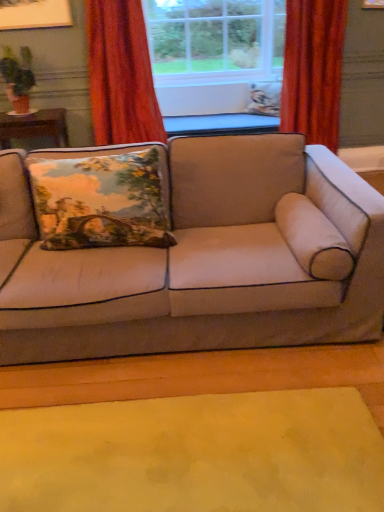
Question: Is velvet-like red curtain at right, positioned as the second curtain in left-to-right order, shorter than floral fabric pillow at center, placed as the 2th pillow when sorted from bottom to top?

Choices:
 (A) no
 (B) yes

Answer: (A)

Question: Is velvet-like red curtain at right, acting as the first curtain starting from the right, to the right of floral fabric pillow at center, which appears as the 2th pillow when viewed from the left, from the viewer's perspective?

Choices:
 (A) yes
 (B) no

Answer: (A)

Question: Can you confirm if velvet-like red curtain at right, acting as the first curtain starting from the right, is wider than floral fabric pillow at center, which is counted as the second pillow, starting from the front?

Choices:
 (A) yes
 (B) no

Answer: (A)

Question: Is velvet-like red curtain at right, acting as the first curtain starting from the right, turned away from floral fabric pillow at center, placed as the 2th pillow when sorted from bottom to top?

Choices:
 (A) no
 (B) yes

Answer: (B)

Question: Is the position of velvet-like red curtain at right, acting as the first curtain starting from the right, more distant than that of floral fabric pillow at center, which appears as the 1th pillow when viewed from the top?

Choices:
 (A) no
 (B) yes

Answer: (A)

Question: In terms of size, does floral fabric pillow at center, which is counted as the second pillow, starting from the front, appear bigger or smaller than beige fabric couch at center?

Choices:
 (A) small
 (B) big

Answer: (A)

Question: Considering their positions, is floral fabric pillow at center, arranged as the 1th pillow when viewed from the back, located in front of or behind beige fabric couch at center?

Choices:
 (A) behind
 (B) front

Answer: (A)

Question: In the image, is floral fabric pillow at center, arranged as the 1th pillow when viewed from the back, on the left side or the right side of beige fabric couch at center?

Choices:
 (A) right
 (B) left

Answer: (A)

Question: In terms of height, does floral fabric pillow at center, which appears as the 1th pillow when viewed from the top, look taller or shorter compared to beige fabric couch at center?

Choices:
 (A) short
 (B) tall

Answer: (A)

Question: Considering their positions, is clear glass window at center located in front of or behind beige fabric couch at center?

Choices:
 (A) behind
 (B) front

Answer: (A)

Question: Is clear glass window at center bigger or smaller than beige fabric couch at center?

Choices:
 (A) small
 (B) big

Answer: (A)

Question: Is clear glass window at center taller or shorter than beige fabric couch at center?

Choices:
 (A) short
 (B) tall

Answer: (B)

Question: Is clear glass window at center spatially inside beige fabric couch at center, or outside of it?

Choices:
 (A) outside
 (B) inside

Answer: (A)

Question: In the image, is velvet floral pillow at left, which appears as the first pillow when viewed from the left, on the left side or the right side of floral fabric pillow at center, which is counted as the second pillow, starting from the front?

Choices:
 (A) left
 (B) right

Answer: (A)

Question: From the image's perspective, is velvet floral pillow at left, which appears as the first pillow when viewed from the left, positioned above or below floral fabric pillow at center, which appears as the 2th pillow when viewed from the left?

Choices:
 (A) above
 (B) below

Answer: (B)